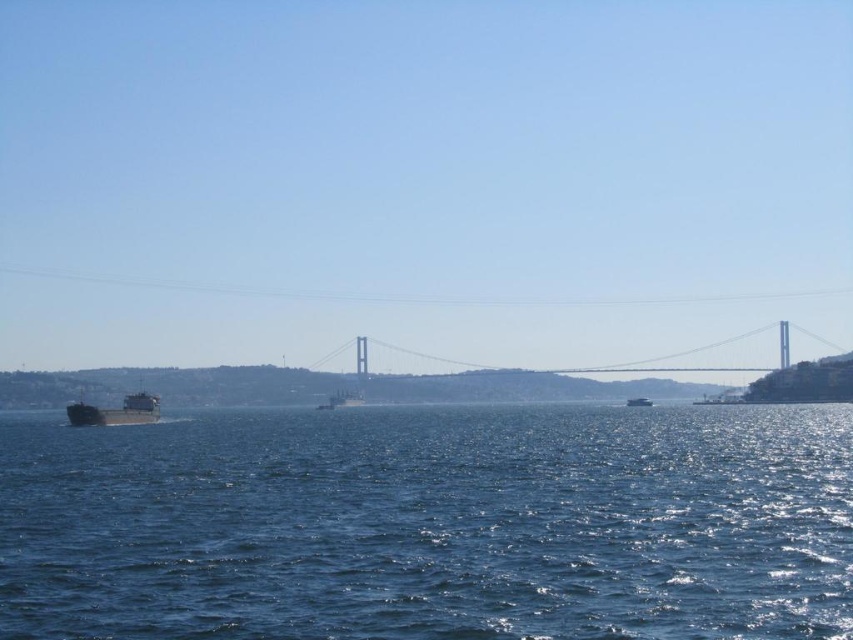
Question: Which object appears closest to the camera in this image?

Choices:
 (A) metallic gray ship at center
 (B) metallic gray cargo ship at left
 (C) metallic silver boat at center
 (D) blue water at center

Answer: (D)

Question: Which object is positioned farthest from the metallic gray cargo ship at left?

Choices:
 (A) metallic gray bridge at center
 (B) blue water at center

Answer: (A)

Question: Considering the real-world distances, which object is closest to the blue water at center?

Choices:
 (A) metallic gray cargo ship at left
 (B) metallic silver boat at center

Answer: (A)

Question: Is metallic gray bridge at center to the right of metallic gray cargo ship at left from the viewer's perspective?

Choices:
 (A) no
 (B) yes

Answer: (B)

Question: Can you confirm if blue water at center is smaller than metallic gray bridge at center?

Choices:
 (A) no
 (B) yes

Answer: (A)

Question: Does metallic gray cargo ship at left appear on the left side of metallic silver boat at center?

Choices:
 (A) no
 (B) yes

Answer: (B)